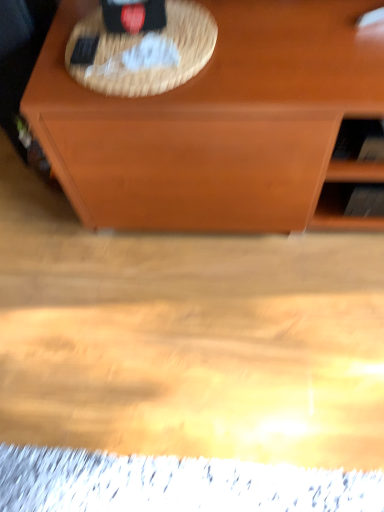
Where is `free space above woven straw picnic basket at upper center (from a real-world perspective)`? The image size is (384, 512). free space above woven straw picnic basket at upper center (from a real-world perspective) is located at coordinates (132, 46).